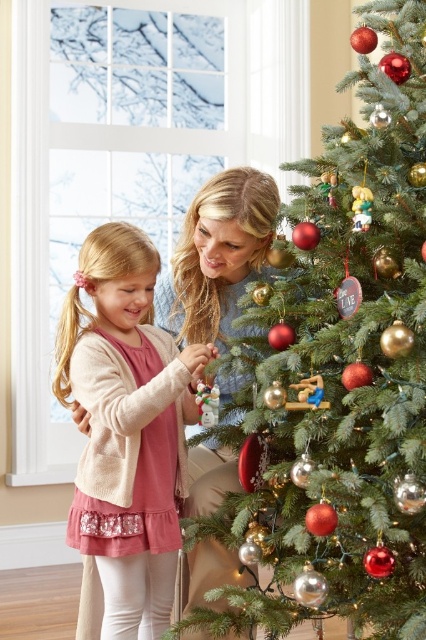
Question: Is the position of shiny metallic ornaments at center more distant than that of pink fabric dress at left?

Choices:
 (A) no
 (B) yes

Answer: (A)

Question: Which object is farther from the camera taking this photo?

Choices:
 (A) shiny metallic ornaments at center
 (B) pink fabric dress at left

Answer: (B)

Question: Among these points, which one is nearest to the camera?

Choices:
 (A) (117, 484)
 (B) (304, 420)

Answer: (B)

Question: Is shiny metallic ornaments at center thinner than pink fabric dress at left?

Choices:
 (A) no
 (B) yes

Answer: (A)

Question: Does shiny metallic ornaments at center have a greater width compared to pink fabric dress at left?

Choices:
 (A) no
 (B) yes

Answer: (B)

Question: Among these points, which one is nearest to the camera?

Choices:
 (A) (359, 138)
 (B) (150, 353)

Answer: (A)